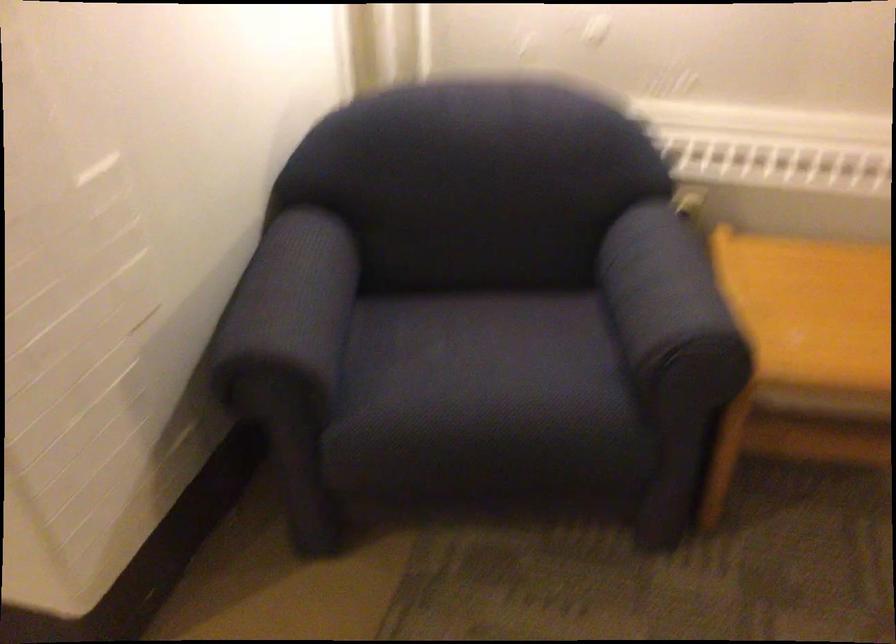
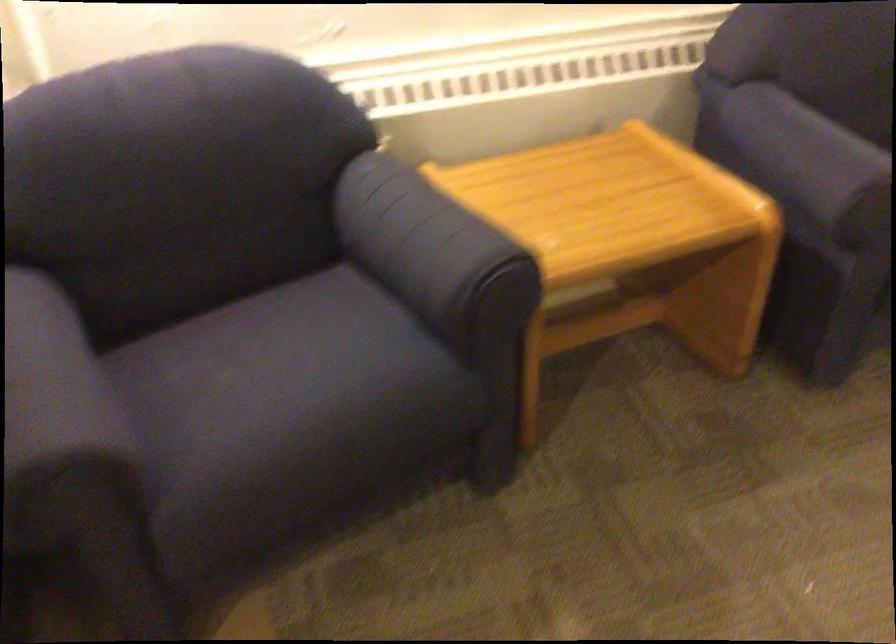
Question: How did the camera likely rotate?

Choices:
 (A) Left
 (B) Right
 (C) Up
 (D) Down

Answer: (B)